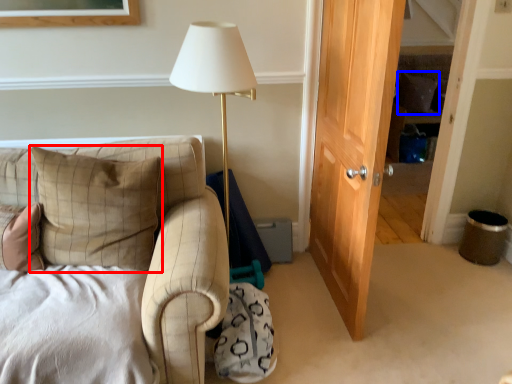
Question: Which object appears farthest to the camera in this image, pillow (highlighted by a red box) or pillow (highlighted by a blue box)?

Choices:
 (A) pillow
 (B) pillow

Answer: (B)